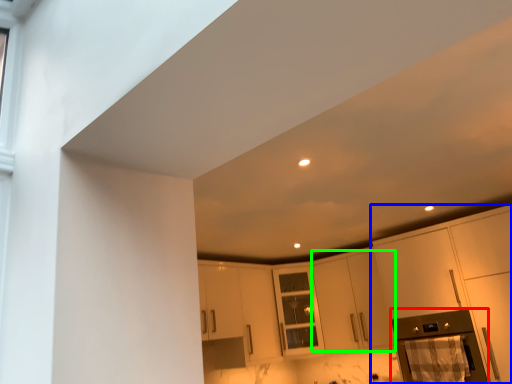
Question: Estimate the real-world distances between objects in this image. Which object is farther from appliance (highlighted by a red box), cabinetry (highlighted by a blue box) or cabinetry (highlighted by a green box)?

Choices:
 (A) cabinetry
 (B) cabinetry

Answer: (B)